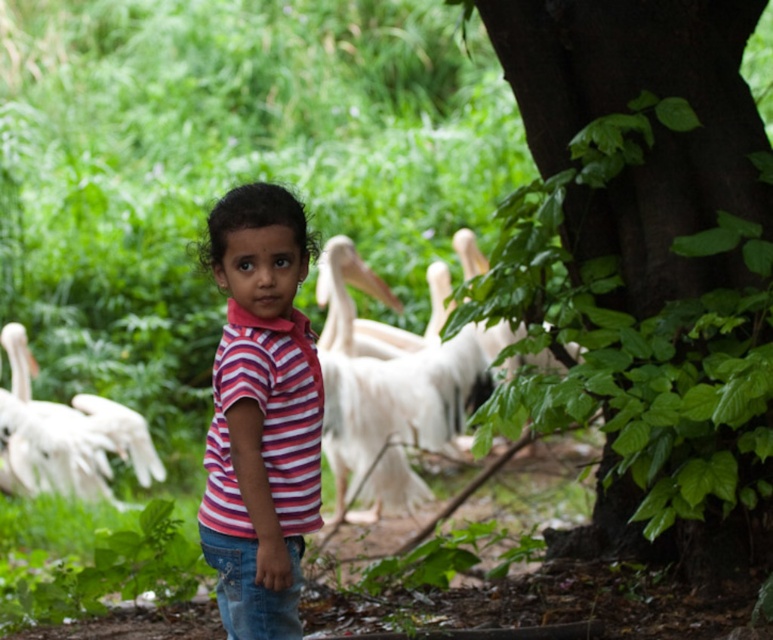
You are a photographer trying to capture a photo of the white feathered pelican at center and the white feathered pelican at lower left. From the photographer viewpoint, which pelican is positioned to the right side?

The white feathered pelican at center is positioned to the right of the white feathered pelican at lower left.

You are a photographer trying to capture the white feathered pelican at center in the image. The camera is set to focus on the point at coordinates 0.620, 0.499. Will the pelican be in focus?

Yes, the white feathered pelican at center is exactly at the coordinates (385, 396), so the camera will focus on it.

You are a photographer trying to capture a photo of the pink striped shirt at center and the green leafy tree at center right. From your current position, which object is located to the right of the other?

The green leafy tree at center right is positioned on the right side of pink striped shirt at center, so the green leafy tree at center right is to the right of the pink striped shirt at center.